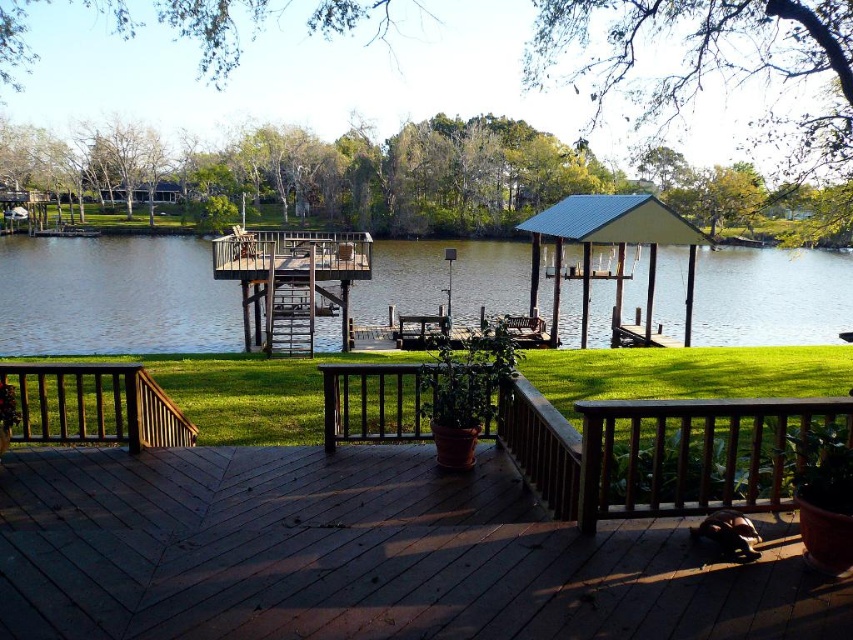
Which is behind, point (627, 602) or point (61, 429)?

The point (61, 429) is more distant.

Which is below, wooden deck at center or brown wooden rail at lower left?

wooden deck at center is lower down.

Locate an element on the screen. This screenshot has width=853, height=640. wooden deck at center is located at coordinates (345, 556).

At what (x,y) coordinates should I click in order to perform the action: click on wooden deck at center. Please return your answer as a coordinate pair (x, y). Image resolution: width=853 pixels, height=640 pixels. Looking at the image, I should click on (345, 556).

In the scene shown: Is brown wooden rail at lower right to the right of brown wooden gazebo at center from the viewer's perspective?

Correct, you'll find brown wooden rail at lower right to the right of brown wooden gazebo at center.

Which is above, brown wooden rail at lower right or brown wooden gazebo at center?

brown wooden gazebo at center is above.

Image resolution: width=853 pixels, height=640 pixels. What do you see at coordinates (692, 452) in the screenshot?
I see `brown wooden rail at lower right` at bounding box center [692, 452].

The height and width of the screenshot is (640, 853). Identify the location of brown wooden rail at lower right. (692, 452).

Which is below, wooden deck at center or brown wooden rail at lower right?

Positioned lower is wooden deck at center.

Can you confirm if wooden deck at center is wider than brown wooden rail at lower right?

Correct, the width of wooden deck at center exceeds that of brown wooden rail at lower right.

You are a GUI agent. You are given a task and a screenshot of the screen. Output one action in this format:
    pyautogui.click(x=<x>, y=<y>)
    Task: Click on the wooden deck at center
    The width and height of the screenshot is (853, 640).
    Given the screenshot: What is the action you would take?
    pyautogui.click(x=345, y=556)